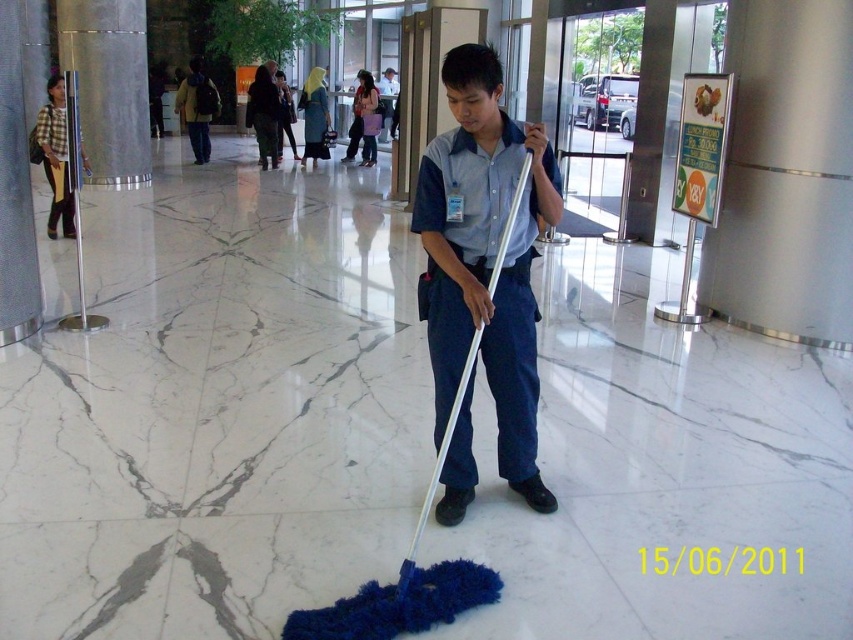
Can you confirm if plaid fabric shirt at left is bigger than light blue shirt at center?

No.

Is point (55, 209) closer to viewer compared to point (387, 115)?

Yes, it is.

Does point (51, 138) come farther from viewer compared to point (389, 92)?

No.

Identify the location of plaid fabric shirt at left. pos(55,163).

Is point (57, 132) positioned after point (189, 108)?

No.

Does plaid fabric shirt at left have a larger size compared to matte black jacket at upper left?

No, plaid fabric shirt at left is not bigger than matte black jacket at upper left.

Is point (47, 132) positioned in front of point (200, 97)?

Yes.

Identify the location of plaid fabric shirt at left. (55, 163).

Can you confirm if matte black jacket at upper left is positioned above light blue shirt at center?

No.

Can you confirm if matte black jacket at upper left is positioned to the right of light blue shirt at center?

In fact, matte black jacket at upper left is to the left of light blue shirt at center.

Is point (216, 109) positioned in front of point (383, 90)?

That is True.

What are the coordinates of `matte black jacket at upper left` in the screenshot? It's located at (196, 108).